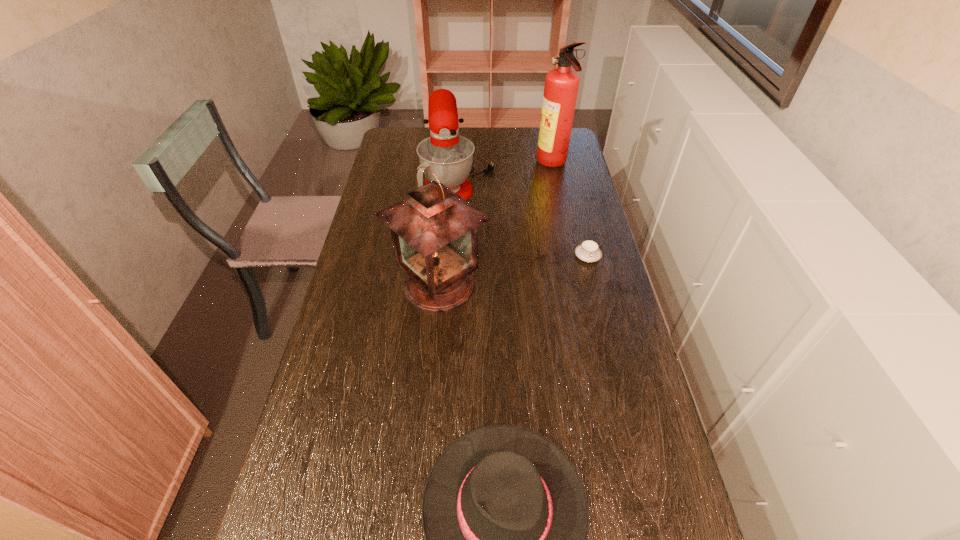
Find the location of a particular element. The height and width of the screenshot is (540, 960). blank region between the teacup and the third tallest object is located at coordinates [x=523, y=215].

You are a GUI agent. You are given a task and a screenshot of the screen. Output one action in this format:
    pyautogui.click(x=<x>, y=<y>)
    Task: Click on the object that is the fourth closest one to the dress hat
    The width and height of the screenshot is (960, 540).
    Given the screenshot: What is the action you would take?
    pyautogui.click(x=561, y=86)

Point out which object is positioned as the third nearest to the teacup. Please provide its 2D coordinates. Your answer should be formatted as a tuple, i.e. [(x, y)], where the tuple contains the x and y coordinates of a point satisfying the conditions above.

[(561, 86)]